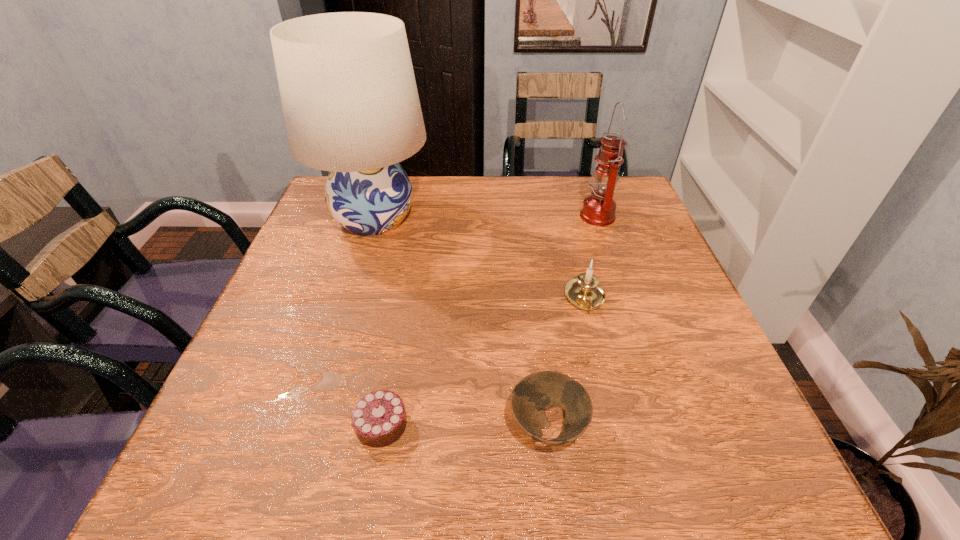
Locate an element on the screen. free location located on the right of the fourth tallest object is located at coordinates (687, 426).

Where is `free space located on the back of the shortest object`? free space located on the back of the shortest object is located at coordinates (409, 274).

I want to click on lampshade positioned at the far edge, so click(x=350, y=102).

At what (x,y) coordinates should I click in order to perform the action: click on oil lamp at the far edge. Please return your answer as a coordinate pair (x, y). Image resolution: width=960 pixels, height=540 pixels. Looking at the image, I should click on (599, 208).

Locate an element on the screen. Image resolution: width=960 pixels, height=540 pixels. bowl present at the near edge is located at coordinates (535, 393).

Identify the location of chocolate cake at the near edge. (379, 419).

Locate an element on the screen. object positioned at the left edge is located at coordinates pos(350,102).

In order to click on object that is at the right edge in this screenshot , I will do `click(599, 208)`.

The height and width of the screenshot is (540, 960). What are the coordinates of `object that is positioned at the far left corner` in the screenshot? It's located at (350, 102).

Find the location of a particular element. The image size is (960, 540). object that is positioned at the far right corner is located at coordinates (599, 208).